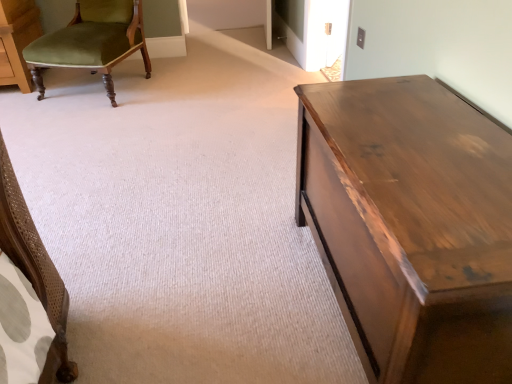
You are a GUI agent. You are given a task and a screenshot of the screen. Output one action in this format:
    pyautogui.click(x=<x>, y=<y>)
    Task: Click on the vacant space that is in between shiny brown wood table at right and green velvet chair at upper left
    This screenshot has width=512, height=384.
    Given the screenshot: What is the action you would take?
    pyautogui.click(x=181, y=150)